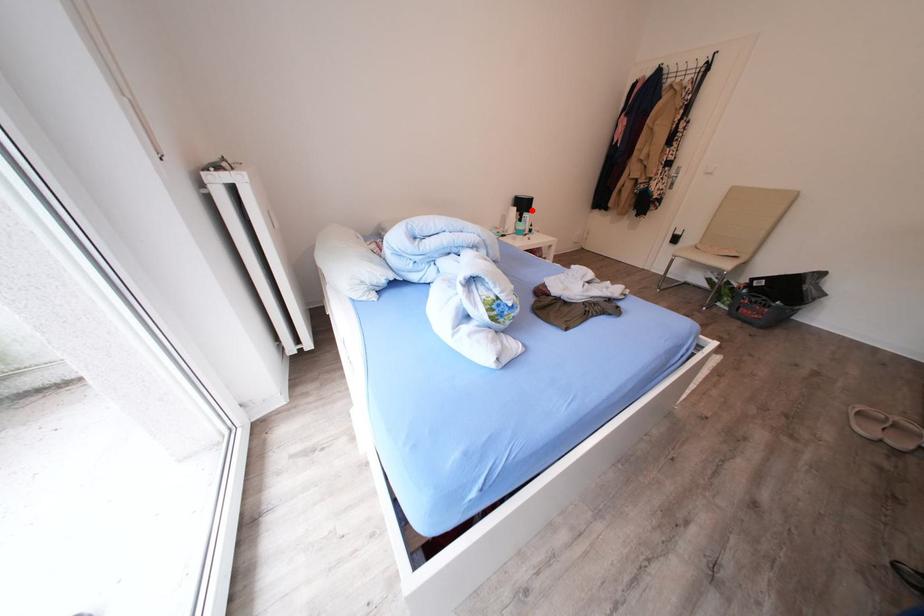
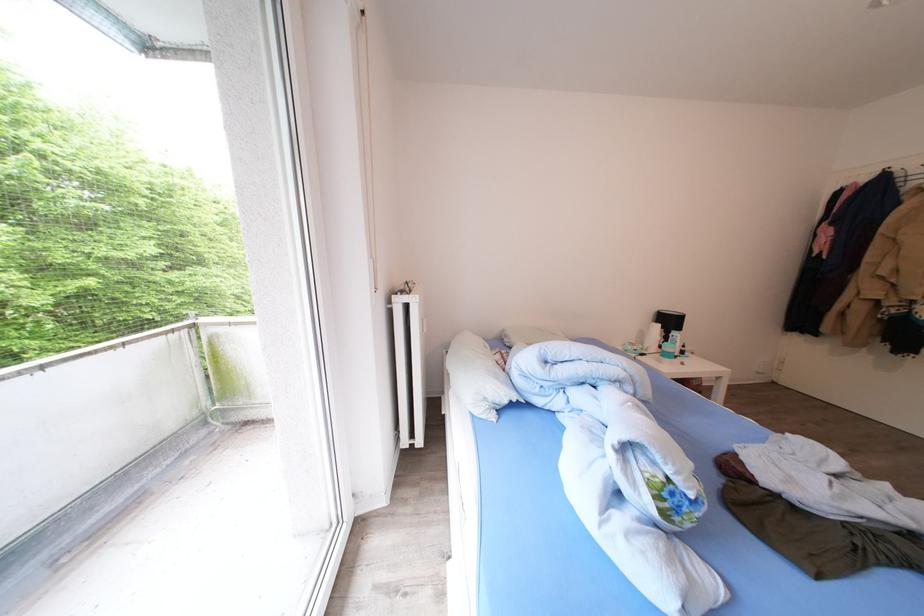
Locate, in the second image, the point that corresponds to the highlighted location in the first image.

(677, 326)